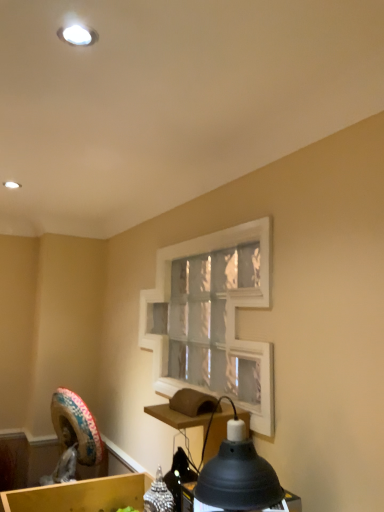
Where is `white matte window frame at center`? The width and height of the screenshot is (384, 512). white matte window frame at center is located at coordinates (212, 318).

The image size is (384, 512). What do you see at coordinates (80, 495) in the screenshot?
I see `wooden cardboard box at lower left` at bounding box center [80, 495].

The height and width of the screenshot is (512, 384). Describe the element at coordinates (238, 477) in the screenshot. I see `matte black lampshade at lower center` at that location.

At what (x,y) coordinates should I click in order to perform the action: click on white matte window frame at center. Please return your answer as a coordinate pair (x, y). Looking at the image, I should click on (212, 318).

Can you tell me how much white matte window frame at center and matte black lampshade at lower center differ in facing direction?

3.53 degrees separate the facing orientations of white matte window frame at center and matte black lampshade at lower center.

Would you say white matte window frame at center is inside or outside matte black lampshade at lower center?

white matte window frame at center is not inside matte black lampshade at lower center, it's outside.

Are white matte window frame at center and matte black lampshade at lower center far apart?

No, there isn't a large distance between white matte window frame at center and matte black lampshade at lower center.

From a real-world perspective, is white matte window frame at center below matte black lampshade at lower center?

Incorrect, from a real-world perspective, white matte window frame at center is higher than matte black lampshade at lower center.

Looking at their sizes, would you say matte black lampshade at lower center is wider or thinner than wooden cardboard box at lower left?

Clearly, matte black lampshade at lower center has less width compared to wooden cardboard box at lower left.

Measure the distance between matte black lampshade at lower center and wooden cardboard box at lower left.

matte black lampshade at lower center is 1.01 meters away from wooden cardboard box at lower left.

Can you see matte black lampshade at lower center touching wooden cardboard box at lower left?

No.

Could wooden cardboard box at lower left be considered to be inside matte black lampshade at lower center?

No, wooden cardboard box at lower left is located outside of matte black lampshade at lower center.

Is matte black lampshade at lower center oriented towards white matte window frame at center?

No, matte black lampshade at lower center is not aimed at white matte window frame at center.

Between matte black lampshade at lower center and white matte window frame at center, which one has larger width?

matte black lampshade at lower center.

Consider the image. Between matte black lampshade at lower center and white matte window frame at center, which one has larger size?

With larger size is white matte window frame at center.

In terms of height, does white matte window frame at center look taller or shorter compared to wooden cardboard box at lower left?

Considering their sizes, white matte window frame at center has more height than wooden cardboard box at lower left.

Is white matte window frame at center wider or thinner than wooden cardboard box at lower left?

Considering their sizes, white matte window frame at center looks slimmer than wooden cardboard box at lower left.

Based on the photo, from a real-world perspective, is white matte window frame at center located higher than wooden cardboard box at lower left?

Correct, in the physical world, white matte window frame at center is higher than wooden cardboard box at lower left.

Does white matte window frame at center turn towards wooden cardboard box at lower left?

No, white matte window frame at center is not oriented towards wooden cardboard box at lower left.

From their relative heights in the image, would you say wooden cardboard box at lower left is taller or shorter than matte black lampshade at lower center?

wooden cardboard box at lower left is shorter than matte black lampshade at lower center.

Can matte black lampshade at lower center be found inside wooden cardboard box at lower left?

That's incorrect, matte black lampshade at lower center is not inside wooden cardboard box at lower left.

From a real-world perspective, which is physically above, wooden cardboard box at lower left or matte black lampshade at lower center?

In real-world perspective, matte black lampshade at lower center is above.

From their relative heights in the image, would you say wooden cardboard box at lower left is taller or shorter than white matte window frame at center?

Considering their sizes, wooden cardboard box at lower left has less height than white matte window frame at center.

Can you see wooden cardboard box at lower left touching white matte window frame at center?

There is a gap between wooden cardboard box at lower left and white matte window frame at center.

From the picture: From a real-world perspective, is wooden cardboard box at lower left located beneath white matte window frame at center?

Yes.

You are a GUI agent. You are given a task and a screenshot of the screen. Output one action in this format:
    pyautogui.click(x=<x>, y=<y>)
    Task: Click on the lamp in front of the white matte window frame at center
    This screenshot has width=384, height=512.
    Given the screenshot: What is the action you would take?
    pyautogui.click(x=238, y=477)

The image size is (384, 512). Identify the location of cardboard box located underneath the matte black lampshade at lower center (from a real-world perspective). (80, 495).

Considering their positions, is white matte window frame at center positioned closer to matte black lampshade at lower center than wooden cardboard box at lower left?

Based on the image, white matte window frame at center appears to be nearer to matte black lampshade at lower center.

From the image, which object appears to be farther from wooden cardboard box at lower left, matte black lampshade at lower center or white matte window frame at center?

matte black lampshade at lower center is positioned further to the anchor wooden cardboard box at lower left.

Looking at the image, which one is located further to white matte window frame at center, wooden cardboard box at lower left or matte black lampshade at lower center?

wooden cardboard box at lower left is further to white matte window frame at center.

Considering their positions, is matte black lampshade at lower center positioned further to white matte window frame at center than wooden cardboard box at lower left?

wooden cardboard box at lower left is positioned further to the anchor white matte window frame at center.

From the image, which object appears to be farther from wooden cardboard box at lower left, white matte window frame at center or matte black lampshade at lower center?

matte black lampshade at lower center is positioned further to the anchor wooden cardboard box at lower left.

Consider the image. Estimate the real-world distances between objects in this image. Which object is further from matte black lampshade at lower center, wooden cardboard box at lower left or white matte window frame at center?

Based on the image, wooden cardboard box at lower left appears to be further to matte black lampshade at lower center.

Locate an element on the screen. The width and height of the screenshot is (384, 512). lamp between white matte window frame at center and wooden cardboard box at lower left from top to bottom is located at coordinates (238, 477).